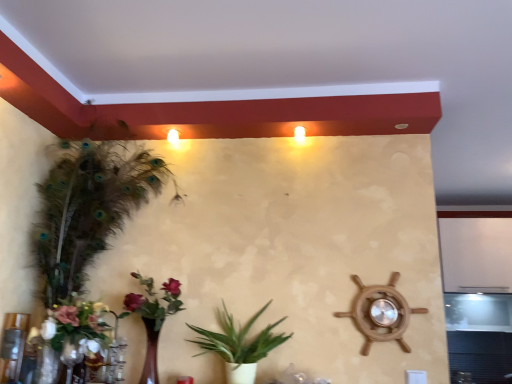
You are a GUI agent. You are given a task and a screenshot of the screen. Output one action in this format:
    pyautogui.click(x=<x>, y=<y>)
    Task: Click on the green leafy plant at center, positioned as the 2th houseplant in left-to-right order
    Image resolution: width=512 pixels, height=384 pixels.
    Given the screenshot: What is the action you would take?
    pyautogui.click(x=239, y=345)

What is the approximate width of green leafy plant at center, positioned as the 2th houseplant in left-to-right order?

The width of green leafy plant at center, positioned as the 2th houseplant in left-to-right order, is 9.61 inches.

This screenshot has height=384, width=512. What are the coordinates of `matte wooden vase with flowers at lower left, which ranks as the 1th floral arrangement in right-to-left order` in the screenshot? It's located at (153, 318).

Where is `white matte floral arrangement at lower left, marked as the 2th floral arrangement in a right-to-left arrangement`? This screenshot has height=384, width=512. white matte floral arrangement at lower left, marked as the 2th floral arrangement in a right-to-left arrangement is located at coordinates (76, 330).

From the image's perspective, count 2nd houseplants upward from the white matte floral arrangement at lower left, the first floral arrangement viewed from the left, and point to it. Please provide its 2D coordinates.

[(86, 228)]

Is green feathered houseplant at left, arranged as the second houseplant when viewed from the right, turned away from white matte floral arrangement at lower left, the first floral arrangement viewed from the left?

Yes.

Is green feathered houseplant at left, arranged as the second houseplant when viewed from the right, in contact with white matte floral arrangement at lower left, marked as the 2th floral arrangement in a right-to-left arrangement?

No, green feathered houseplant at left, arranged as the second houseplant when viewed from the right, is not making contact with white matte floral arrangement at lower left, marked as the 2th floral arrangement in a right-to-left arrangement.

Where is `houseplant to the right of green feathered houseplant at left, arranged as the second houseplant when viewed from the right`? The image size is (512, 384). houseplant to the right of green feathered houseplant at left, arranged as the second houseplant when viewed from the right is located at coordinates (239, 345).

Is green leafy plant at center, the 1th houseplant viewed from the right, completely or partially inside green feathered houseplant at left, which is counted as the 1th houseplant, starting from the left?

No, green leafy plant at center, the 1th houseplant viewed from the right, is not a part of green feathered houseplant at left, which is counted as the 1th houseplant, starting from the left.

From the image's perspective, does green feathered houseplant at left, which is counted as the 1th houseplant, starting from the left, appear higher than green leafy plant at center, positioned as the 2th houseplant in left-to-right order?

Correct, green feathered houseplant at left, which is counted as the 1th houseplant, starting from the left, appears higher than green leafy plant at center, positioned as the 2th houseplant in left-to-right order, in the image.

Is green leafy plant at center, positioned as the 2th houseplant in left-to-right order, next to green feathered houseplant at left, arranged as the second houseplant when viewed from the right, and touching it?

No, green leafy plant at center, positioned as the 2th houseplant in left-to-right order, is not beside green feathered houseplant at left, arranged as the second houseplant when viewed from the right.

From the picture: Is the position of green leafy plant at center, the 1th houseplant viewed from the right, more distant than that of green feathered houseplant at left, arranged as the second houseplant when viewed from the right?

Yes, it is.

Is green leafy plant at center, the 1th houseplant viewed from the right, not inside green feathered houseplant at left, which is counted as the 1th houseplant, starting from the left?

Indeed, green leafy plant at center, the 1th houseplant viewed from the right, is completely outside green feathered houseplant at left, which is counted as the 1th houseplant, starting from the left.

Considering the relative sizes of green leafy plant at center, positioned as the 2th houseplant in left-to-right order, and green feathered houseplant at left, which is counted as the 1th houseplant, starting from the left, in the image provided, is green leafy plant at center, positioned as the 2th houseplant in left-to-right order, thinner than green feathered houseplant at left, which is counted as the 1th houseplant, starting from the left,?

Yes.

Is green feathered houseplant at left, which is counted as the 1th houseplant, starting from the left, situated inside matte wooden vase with flowers at lower left, which ranks as the 1th floral arrangement in right-to-left order, or outside?

The correct answer is: outside.

Considering the relative positions of green feathered houseplant at left, arranged as the second houseplant when viewed from the right, and matte wooden vase with flowers at lower left, the 2th floral arrangement in the left-to-right sequence, in the image provided, is green feathered houseplant at left, arranged as the second houseplant when viewed from the right, to the right of matte wooden vase with flowers at lower left, the 2th floral arrangement in the left-to-right sequence, from the viewer's perspective?

Incorrect, green feathered houseplant at left, arranged as the second houseplant when viewed from the right, is not on the right side of matte wooden vase with flowers at lower left, the 2th floral arrangement in the left-to-right sequence.

Where is `the 2nd houseplant in front of the matte wooden vase with flowers at lower left, the 2th floral arrangement in the left-to-right sequence, starting your count from the anchor`? Image resolution: width=512 pixels, height=384 pixels. the 2nd houseplant in front of the matte wooden vase with flowers at lower left, the 2th floral arrangement in the left-to-right sequence, starting your count from the anchor is located at coordinates (86, 228).

Does matte wooden vase with flowers at lower left, which ranks as the 1th floral arrangement in right-to-left order, have a smaller size compared to green feathered houseplant at left, which is counted as the 1th houseplant, starting from the left?

Yes.

Is matte wooden vase with flowers at lower left, which ranks as the 1th floral arrangement in right-to-left order, in contact with green feathered houseplant at left, which is counted as the 1th houseplant, starting from the left?

matte wooden vase with flowers at lower left, which ranks as the 1th floral arrangement in right-to-left order, and green feathered houseplant at left, which is counted as the 1th houseplant, starting from the left, are clearly separated.

Is matte wooden vase with flowers at lower left, the 2th floral arrangement in the left-to-right sequence, at the left side of green feathered houseplant at left, arranged as the second houseplant when viewed from the right?

In fact, matte wooden vase with flowers at lower left, the 2th floral arrangement in the left-to-right sequence, is to the right of green feathered houseplant at left, arranged as the second houseplant when viewed from the right.

From a real-world perspective, is matte wooden vase with flowers at lower left, the 2th floral arrangement in the left-to-right sequence, under green feathered houseplant at left, arranged as the second houseplant when viewed from the right?

Correct, in the physical world, matte wooden vase with flowers at lower left, the 2th floral arrangement in the left-to-right sequence, is lower than green feathered houseplant at left, arranged as the second houseplant when viewed from the right.

In the scene shown: Is matte wooden vase with flowers at lower left, the 2th floral arrangement in the left-to-right sequence, aimed at green leafy plant at center, positioned as the 2th houseplant in left-to-right order?

No, matte wooden vase with flowers at lower left, the 2th floral arrangement in the left-to-right sequence, is not turned towards green leafy plant at center, positioned as the 2th houseplant in left-to-right order.

Where is `floral arrangement positioned vertically above the green leafy plant at center, positioned as the 2th houseplant in left-to-right order (from a real-world perspective)`? floral arrangement positioned vertically above the green leafy plant at center, positioned as the 2th houseplant in left-to-right order (from a real-world perspective) is located at coordinates (153, 318).

Would you say matte wooden vase with flowers at lower left, which ranks as the 1th floral arrangement in right-to-left order, is a long distance from green leafy plant at center, positioned as the 2th houseplant in left-to-right order?

No, matte wooden vase with flowers at lower left, which ranks as the 1th floral arrangement in right-to-left order, is not far away from green leafy plant at center, positioned as the 2th houseplant in left-to-right order.

Which object is positioned more to the right, matte wooden vase with flowers at lower left, the 2th floral arrangement in the left-to-right sequence, or green leafy plant at center, positioned as the 2th houseplant in left-to-right order?

From the viewer's perspective, green leafy plant at center, positioned as the 2th houseplant in left-to-right order, appears more on the right side.

Is green leafy plant at center, positioned as the 2th houseplant in left-to-right order, situated inside matte wooden vase with flowers at lower left, the 2th floral arrangement in the left-to-right sequence, or outside?

green leafy plant at center, positioned as the 2th houseplant in left-to-right order, is not inside matte wooden vase with flowers at lower left, the 2th floral arrangement in the left-to-right sequence, it's outside.

Can you confirm if green leafy plant at center, the 1th houseplant viewed from the right, is bigger than matte wooden vase with flowers at lower left, the 2th floral arrangement in the left-to-right sequence?

Indeed, green leafy plant at center, the 1th houseplant viewed from the right, has a larger size compared to matte wooden vase with flowers at lower left, the 2th floral arrangement in the left-to-right sequence.

Which of these two, green leafy plant at center, the 1th houseplant viewed from the right, or matte wooden vase with flowers at lower left, the 2th floral arrangement in the left-to-right sequence, stands shorter?

green leafy plant at center, the 1th houseplant viewed from the right.

Locate an element on the screen. The image size is (512, 384). houseplant on the left of the white matte floral arrangement at lower left, the first floral arrangement viewed from the left is located at coordinates (86, 228).

This screenshot has width=512, height=384. What are the coordinates of `houseplant that appears above the green leafy plant at center, positioned as the 2th houseplant in left-to-right order (from a real-world perspective)` in the screenshot? It's located at (86, 228).

Based on their spatial positions, is matte wooden vase with flowers at lower left, the 2th floral arrangement in the left-to-right sequence, or green leafy plant at center, positioned as the 2th houseplant in left-to-right order, closer to white matte floral arrangement at lower left, marked as the 2th floral arrangement in a right-to-left arrangement?

matte wooden vase with flowers at lower left, the 2th floral arrangement in the left-to-right sequence, is closer to white matte floral arrangement at lower left, marked as the 2th floral arrangement in a right-to-left arrangement.

When comparing their distances from white matte floral arrangement at lower left, the first floral arrangement viewed from the left, does green feathered houseplant at left, which is counted as the 1th houseplant, starting from the left, or matte wooden vase with flowers at lower left, which ranks as the 1th floral arrangement in right-to-left order, seem closer?

Among the two, green feathered houseplant at left, which is counted as the 1th houseplant, starting from the left, is located nearer to white matte floral arrangement at lower left, the first floral arrangement viewed from the left.

Considering their positions, is green leafy plant at center, the 1th houseplant viewed from the right, positioned further to matte wooden vase with flowers at lower left, the 2th floral arrangement in the left-to-right sequence, than white matte floral arrangement at lower left, marked as the 2th floral arrangement in a right-to-left arrangement?

Among the two, green leafy plant at center, the 1th houseplant viewed from the right, is located further to matte wooden vase with flowers at lower left, the 2th floral arrangement in the left-to-right sequence.

Estimate the real-world distances between objects in this image. Which object is further from matte wooden vase with flowers at lower left, the 2th floral arrangement in the left-to-right sequence, white matte floral arrangement at lower left, the first floral arrangement viewed from the left, or green feathered houseplant at left, which is counted as the 1th houseplant, starting from the left?

green feathered houseplant at left, which is counted as the 1th houseplant, starting from the left, is positioned further to the anchor matte wooden vase with flowers at lower left, the 2th floral arrangement in the left-to-right sequence.

Considering their positions, is green leafy plant at center, positioned as the 2th houseplant in left-to-right order, positioned further to green feathered houseplant at left, arranged as the second houseplant when viewed from the right, than matte wooden vase with flowers at lower left, the 2th floral arrangement in the left-to-right sequence?

green leafy plant at center, positioned as the 2th houseplant in left-to-right order, is positioned further to the anchor green feathered houseplant at left, arranged as the second houseplant when viewed from the right.

From the image, which object appears to be nearer to matte wooden vase with flowers at lower left, the 2th floral arrangement in the left-to-right sequence, green feathered houseplant at left, arranged as the second houseplant when viewed from the right, or white matte floral arrangement at lower left, the first floral arrangement viewed from the left?

The object closer to matte wooden vase with flowers at lower left, the 2th floral arrangement in the left-to-right sequence, is white matte floral arrangement at lower left, the first floral arrangement viewed from the left.

In the scene shown: Considering their positions, is green leafy plant at center, the 1th houseplant viewed from the right, positioned closer to green feathered houseplant at left, arranged as the second houseplant when viewed from the right, than white matte floral arrangement at lower left, the first floral arrangement viewed from the left?

Among the two, white matte floral arrangement at lower left, the first floral arrangement viewed from the left, is located nearer to green feathered houseplant at left, arranged as the second houseplant when viewed from the right.

Which object lies further to the anchor point matte wooden vase with flowers at lower left, the 2th floral arrangement in the left-to-right sequence, green leafy plant at center, positioned as the 2th houseplant in left-to-right order, or green feathered houseplant at left, which is counted as the 1th houseplant, starting from the left?

green feathered houseplant at left, which is counted as the 1th houseplant, starting from the left, is positioned further to the anchor matte wooden vase with flowers at lower left, the 2th floral arrangement in the left-to-right sequence.

The height and width of the screenshot is (384, 512). In order to click on floral arrangement that lies between green feathered houseplant at left, arranged as the second houseplant when viewed from the right, and white matte floral arrangement at lower left, marked as the 2th floral arrangement in a right-to-left arrangement, from top to bottom in this screenshot , I will do `click(153, 318)`.

The height and width of the screenshot is (384, 512). I want to click on floral arrangement located between white matte floral arrangement at lower left, the first floral arrangement viewed from the left, and green leafy plant at center, the 1th houseplant viewed from the right, in the left-right direction, so click(x=153, y=318).